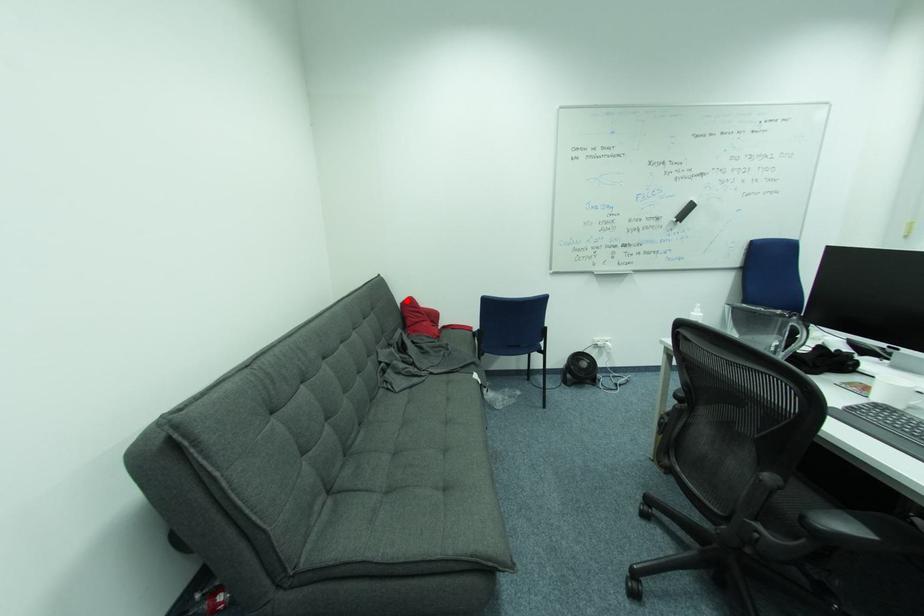
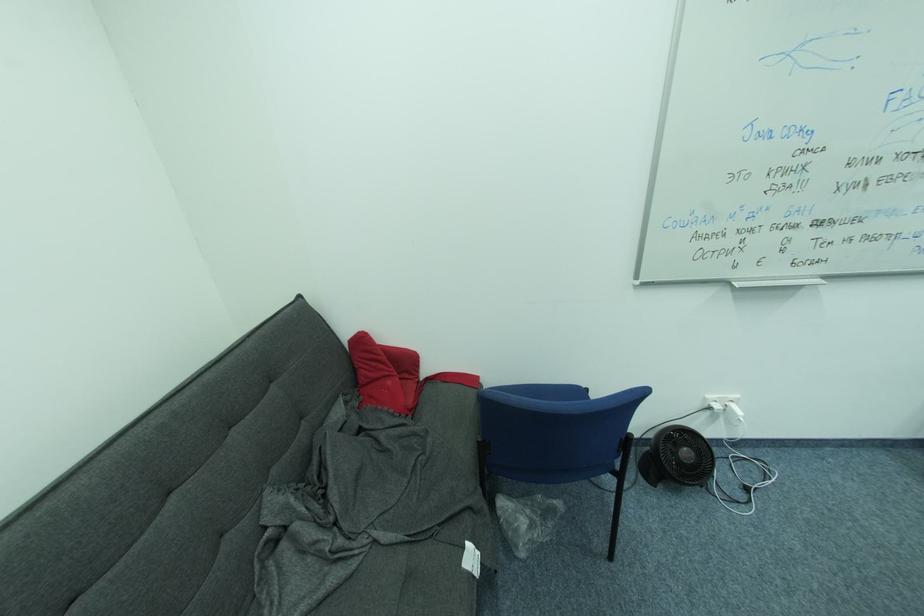
Find the pixel in the second image that matches the highlighted location in the first image.

(353, 336)